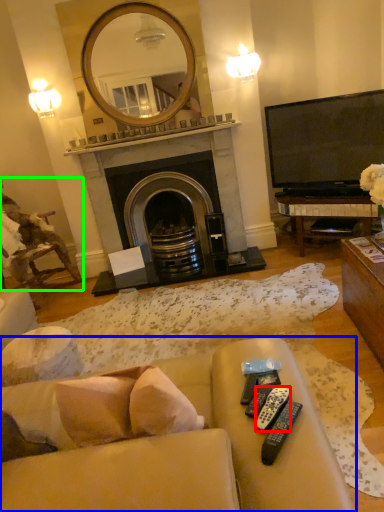
Question: Based on their relative distances, which object is nearer to remote control (highlighted by a red box)? Choose from studio couch (highlighted by a blue box) and chair (highlighted by a green box).

Choices:
 (A) studio couch
 (B) chair

Answer: (A)